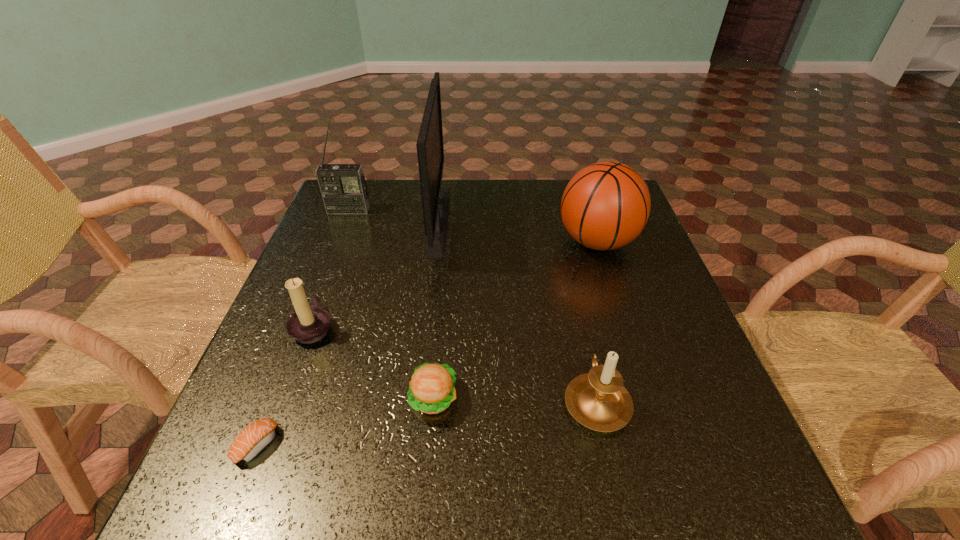
Where is `free region located 0.260m on the front of the third tallest object`? The width and height of the screenshot is (960, 540). free region located 0.260m on the front of the third tallest object is located at coordinates (633, 352).

Find the location of `vacant area situated 0.270m with a handle on the side of the right candle holder`. vacant area situated 0.270m with a handle on the side of the right candle holder is located at coordinates (568, 277).

Where is `free space located 0.180m with a handle on the side of the right candle holder`? The height and width of the screenshot is (540, 960). free space located 0.180m with a handle on the side of the right candle holder is located at coordinates [x=575, y=303].

Locate an element on the screen. This screenshot has height=540, width=960. free space located with a handle on the side of the right candle holder is located at coordinates (567, 272).

Identify the location of free space located 0.310m on the wick of the farther candle holder. (477, 327).

At what (x,y) coordinates should I click in order to perform the action: click on vacant space situated on the right of the second shortest object. Please return your answer as a coordinate pair (x, y). The width and height of the screenshot is (960, 540). Looking at the image, I should click on (521, 399).

What are the coordinates of `free space located 0.050m on the front of the shortest object` in the screenshot? It's located at (234, 499).

The width and height of the screenshot is (960, 540). In order to click on monitor that is positioned at the far edge in this screenshot , I will do `click(435, 200)`.

You are a GUI agent. You are given a task and a screenshot of the screen. Output one action in this format:
    pyautogui.click(x=<x>, y=<y>)
    Task: Click on the radio receiver that is at the far edge
    This screenshot has height=540, width=960.
    Given the screenshot: What is the action you would take?
    pyautogui.click(x=344, y=191)

This screenshot has height=540, width=960. I want to click on basketball at the far edge, so click(x=606, y=205).